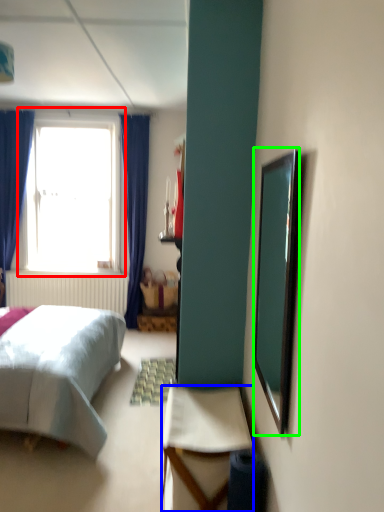
Question: Estimate the real-world distances between objects in this image. Which object is farther from window (highlighted by a red box), desk (highlighted by a blue box) or mirror (highlighted by a green box)?

Choices:
 (A) desk
 (B) mirror

Answer: (B)